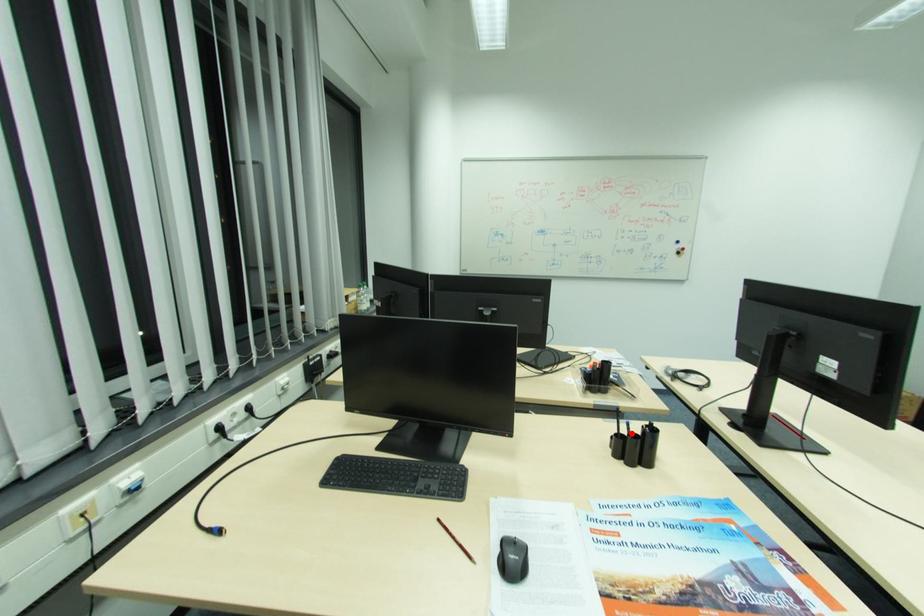
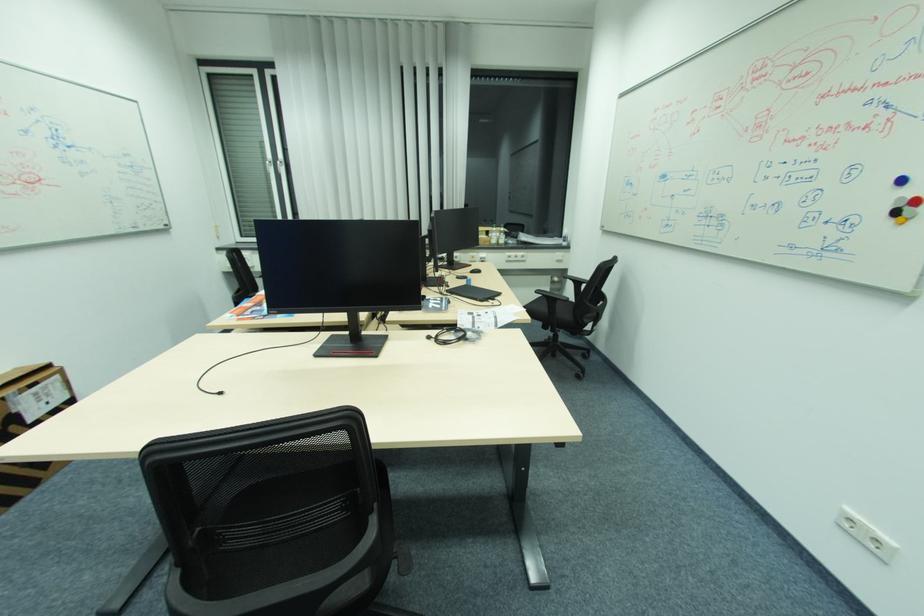
Question: I am providing you with two images of the same scene from different viewpoints. A red point is marked on the first image. Is the red point's position out of view in image 2?

Choices:
 (A) Yes
 (B) No

Answer: (A)